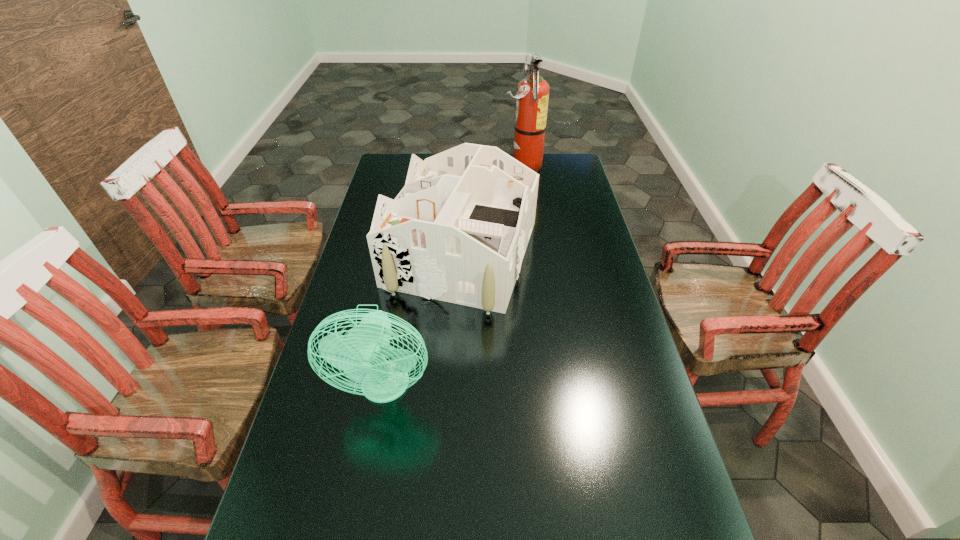
The height and width of the screenshot is (540, 960). I want to click on fan present at the left edge, so click(x=361, y=355).

You are a GUI agent. You are given a task and a screenshot of the screen. Output one action in this format:
    pyautogui.click(x=<x>, y=<y>)
    Task: Click on the dollhouse that is positioned at the left edge
    Image resolution: width=960 pixels, height=540 pixels.
    Given the screenshot: What is the action you would take?
    pyautogui.click(x=457, y=232)

Image resolution: width=960 pixels, height=540 pixels. I want to click on object present at the right edge, so click(532, 95).

Find the location of a particular element. The width and height of the screenshot is (960, 540). object that is at the far right corner is located at coordinates (532, 95).

You are a GUI agent. You are given a task and a screenshot of the screen. Output one action in this format:
    pyautogui.click(x=<x>, y=<y>)
    Task: Click on the vacant space at the left edge of the desktop
    The image size is (960, 540).
    Given the screenshot: What is the action you would take?
    pyautogui.click(x=370, y=220)

The height and width of the screenshot is (540, 960). What are the coordinates of `blank space at the right edge of the desktop` in the screenshot? It's located at (589, 199).

In the image, there is a desktop. Identify the location of vacant space at the far right corner. This screenshot has width=960, height=540. (569, 154).

Identify which object is located as the second nearest to the tallest object. Please provide its 2D coordinates. Your answer should be formatted as a tuple, i.e. [(x, y)], where the tuple contains the x and y coordinates of a point satisfying the conditions above.

[(361, 355)]

Select which object appears as the closest to the second farthest object. Please provide its 2D coordinates. Your answer should be formatted as a tuple, i.e. [(x, y)], where the tuple contains the x and y coordinates of a point satisfying the conditions above.

[(361, 355)]

You are a GUI agent. You are given a task and a screenshot of the screen. Output one action in this format:
    pyautogui.click(x=<x>, y=<y>)
    Task: Click on the vacant space that satisfies the following two spatial constraints: 1. from the nozzle of the fire extinguisher; 2. in front of the fan to blow air
    
    Given the screenshot: What is the action you would take?
    pyautogui.click(x=554, y=389)